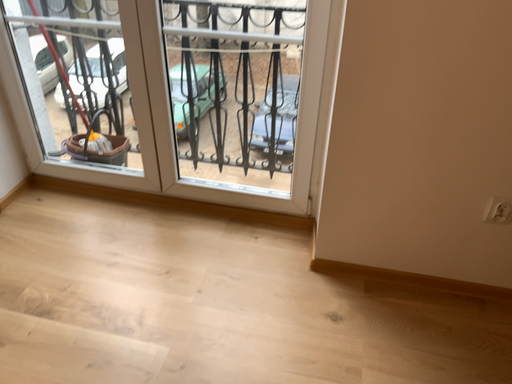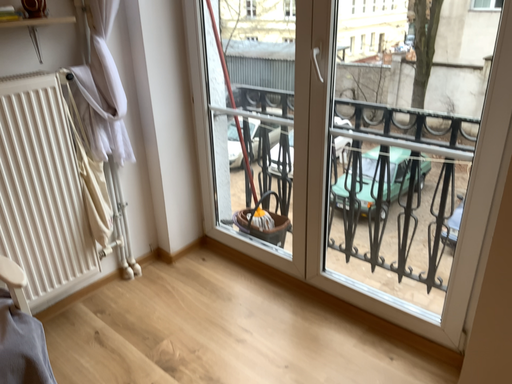
Question: How did the camera likely rotate when shooting the video?

Choices:
 (A) rotated downward
 (B) rotated upward

Answer: (B)